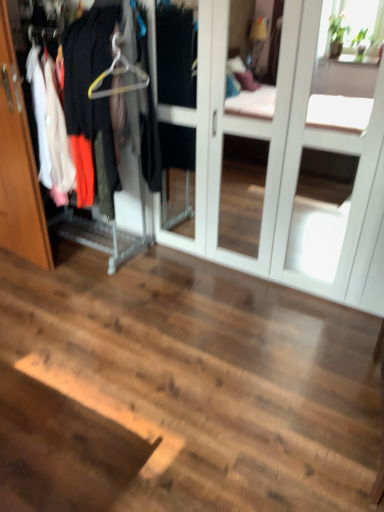
Identify the location of free point below metallic hanger at left (from a real-world perspective). The width and height of the screenshot is (384, 512). (81, 244).